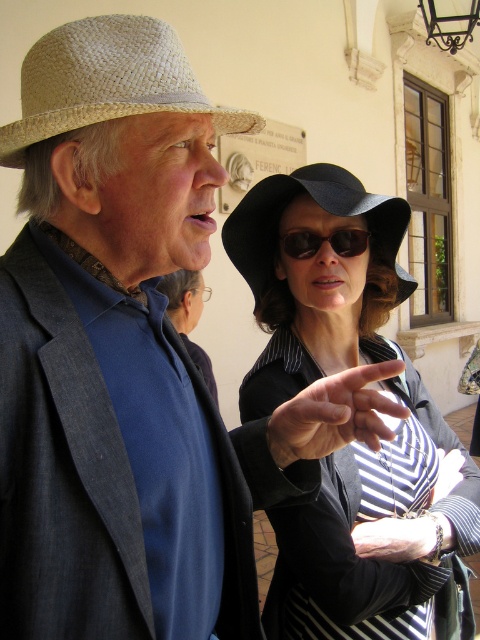
Question: Is matte straw hat at center to the right of sunglasses at center from the viewer's perspective?

Choices:
 (A) yes
 (B) no

Answer: (B)

Question: Is black felt hat at center in front of sunglasses at center?

Choices:
 (A) no
 (B) yes

Answer: (B)

Question: Does matte straw hat at center have a greater width compared to sunglasses at center?

Choices:
 (A) no
 (B) yes

Answer: (B)

Question: Which point is closer to the camera?

Choices:
 (A) click(x=60, y=115)
 (B) click(x=367, y=230)
 (C) click(x=336, y=605)

Answer: (A)

Question: Among these objects, which one is nearest to the camera?

Choices:
 (A) black felt hat at center
 (B) sunglasses at center

Answer: (A)

Question: Estimate the real-world distances between objects in this image. Which object is closer to the black felt hat at center?

Choices:
 (A) matte straw hat at center
 (B) natural straw hat at upper left

Answer: (A)